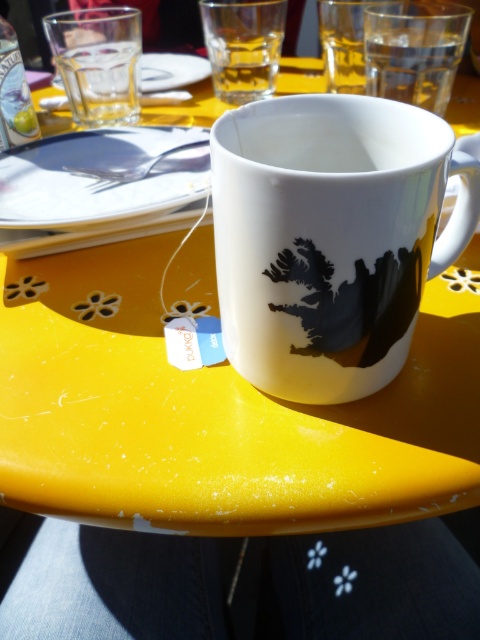
Is point (314, 141) more distant than point (144, 125)?

No, (314, 141) is in front of (144, 125).

Between point (425, 189) and point (23, 180), which one is positioned behind?

Point (23, 180)

You are a GUI agent. You are given a task and a screenshot of the screen. Output one action in this format:
    pyautogui.click(x=<x>, y=<y>)
    Task: Click on the white glossy mug at center
    The image size is (480, 640).
    Given the screenshot: What is the action you would take?
    pyautogui.click(x=331, y=237)

This screenshot has height=640, width=480. What do you see at coordinates (101, 176) in the screenshot?
I see `white porcelain saucer at upper center` at bounding box center [101, 176].

What are the coordinates of `white porcelain saucer at upper center` in the screenshot? It's located at (101, 176).

Is point (14, 157) closer to camera compared to point (194, 65)?

Yes, point (14, 157) is closer to viewer.

The image size is (480, 640). In order to click on white porcelain saucer at upper center in this screenshot , I will do `click(101, 176)`.

Who is positioned more to the right, white glossy mug at center or transparent glass at upper left?

white glossy mug at center is more to the right.

Between white glossy mug at center and transparent glass at upper left, which one appears on the left side from the viewer's perspective?

Positioned to the left is transparent glass at upper left.

Identify the location of white glossy mug at center. (331, 237).